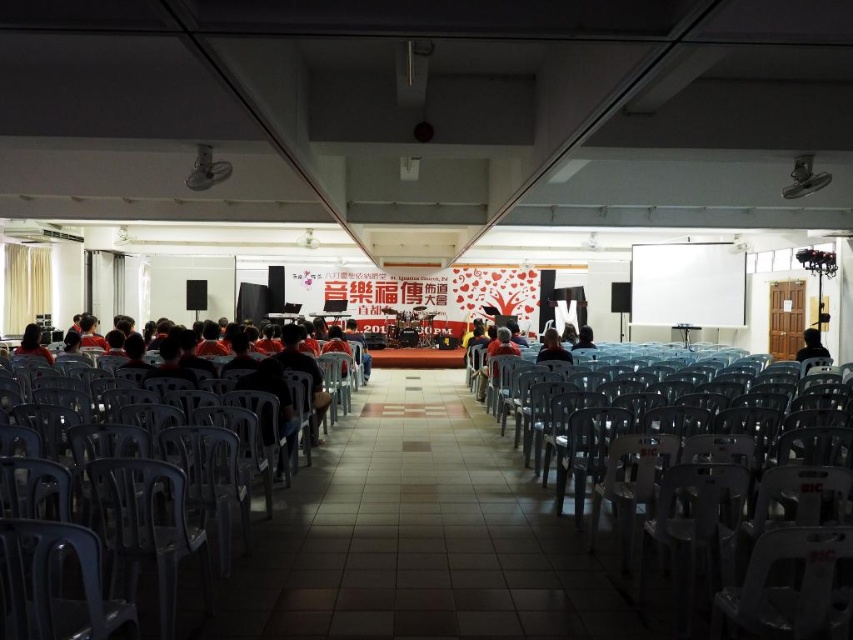
Question: Which point is closer to the camera?

Choices:
 (A) matte black jacket at center
 (B) plastic gray chair at center
 (C) matte black shirt at center
 (D) orange fabric shirt at center

Answer: (B)

Question: Can you confirm if plastic gray chair at center is wider than orange fabric shirt at center?

Choices:
 (A) yes
 (B) no

Answer: (A)

Question: Which point is closer to the camera taking this photo?

Choices:
 (A) (799, 348)
 (B) (346, 328)

Answer: (A)

Question: In this image, where is plastic gray chair at center located relative to white matte projection screen at upper center?

Choices:
 (A) below
 (B) above

Answer: (A)

Question: Is matte black shirt at center to the left of orange fabric shirt at center from the viewer's perspective?

Choices:
 (A) no
 (B) yes

Answer: (A)

Question: Which is nearer to the matte black jacket at center?

Choices:
 (A) matte black hair at left
 (B) white matte projection screen at upper center

Answer: (B)